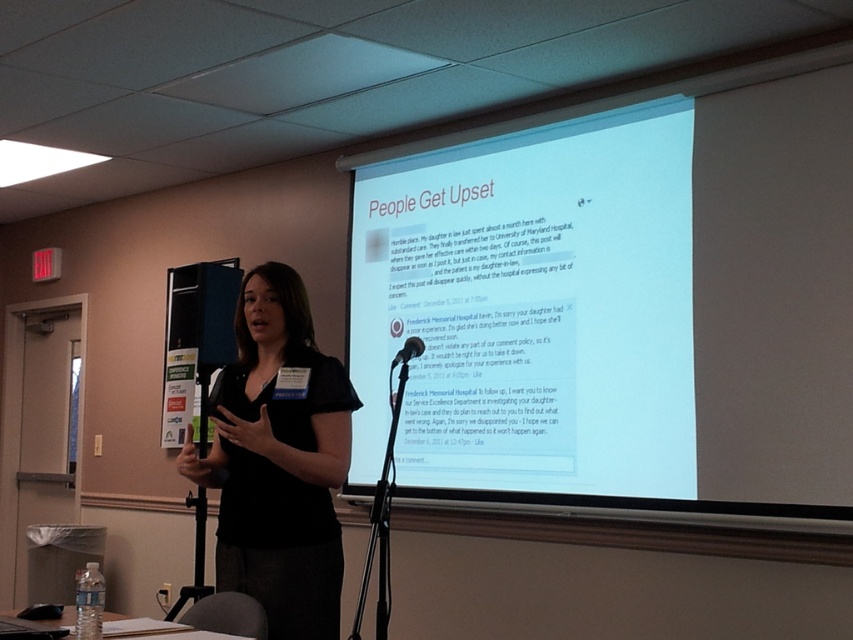
Question: Which is nearer to the black matte microphone at center?

Choices:
 (A) white matte projector screen at upper center
 (B) black matte shirt at center

Answer: (B)

Question: Does black matte shirt at center appear on the left side of black matte microphone at center?

Choices:
 (A) yes
 (B) no

Answer: (A)

Question: Does white matte projector screen at upper center appear on the right side of black matte microphone at center?

Choices:
 (A) yes
 (B) no

Answer: (A)

Question: Which object is the farthest from the black matte microphone at center?

Choices:
 (A) white matte projector screen at upper center
 (B) black matte shirt at center

Answer: (A)

Question: Which object is closer to the camera taking this photo?

Choices:
 (A) black matte microphone at center
 (B) white matte projector screen at upper center

Answer: (A)

Question: Is black matte shirt at center below black matte microphone at center?

Choices:
 (A) yes
 (B) no

Answer: (A)